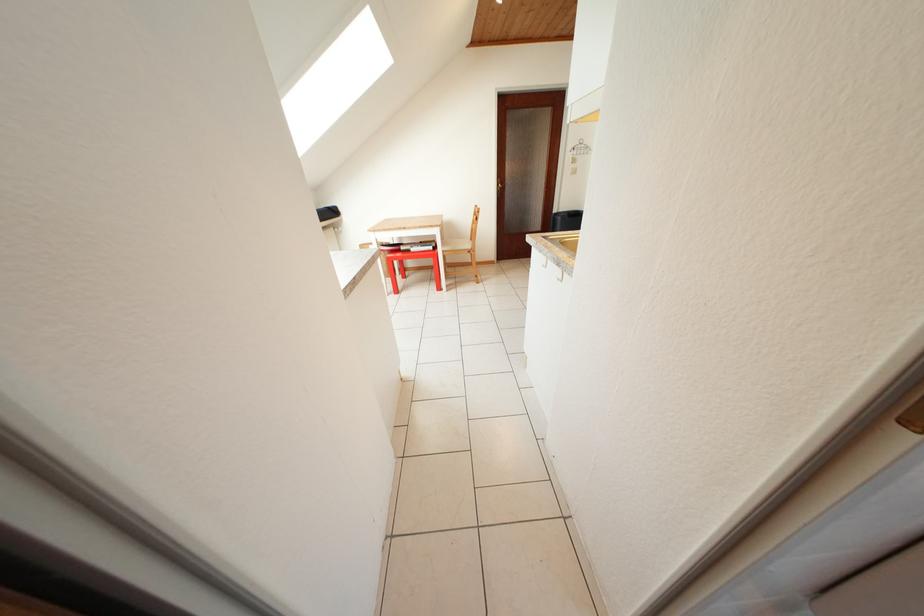
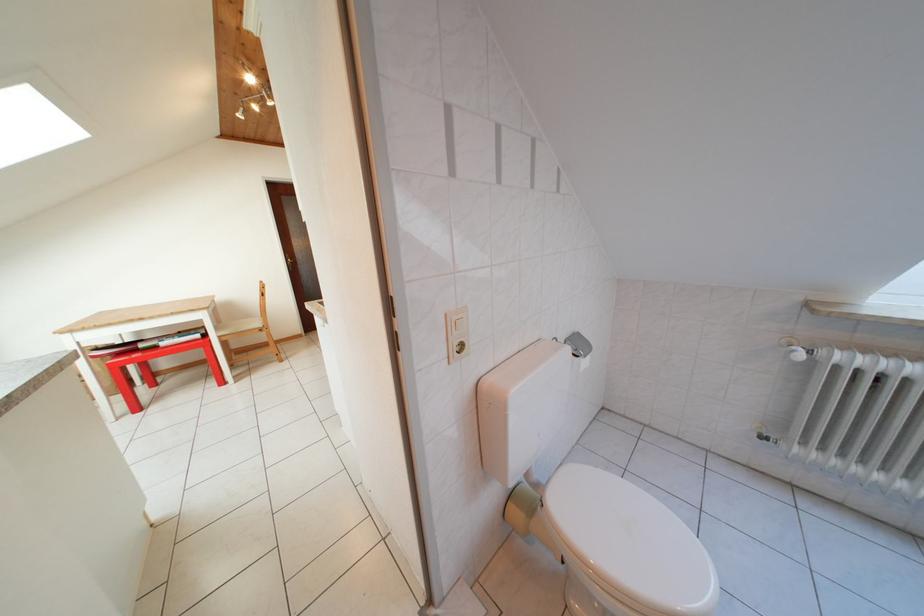
Question: The first image is from the beginning of the video and the second image is from the end. How did the camera likely rotate when shooting the video?

Choices:
 (A) Left
 (B) Right
 (C) Up
 (D) Down

Answer: (B)